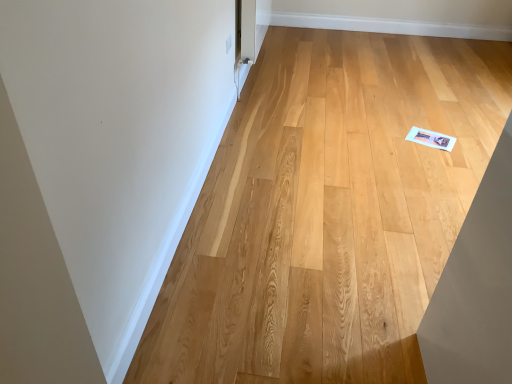
At what (x,y) coordinates should I click in order to perform the action: click on empty space that is to the right of white glossy door at upper center. Please return your answer as a coordinate pair (x, y). The height and width of the screenshot is (384, 512). Looking at the image, I should click on (308, 73).